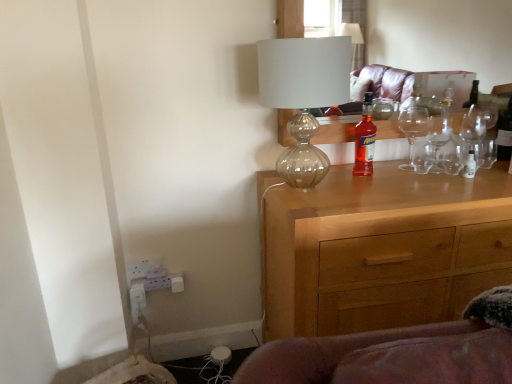
The height and width of the screenshot is (384, 512). I want to click on vacant point to the right of translucent glass bottle at center, which is the first bottle from front to back, so click(x=406, y=177).